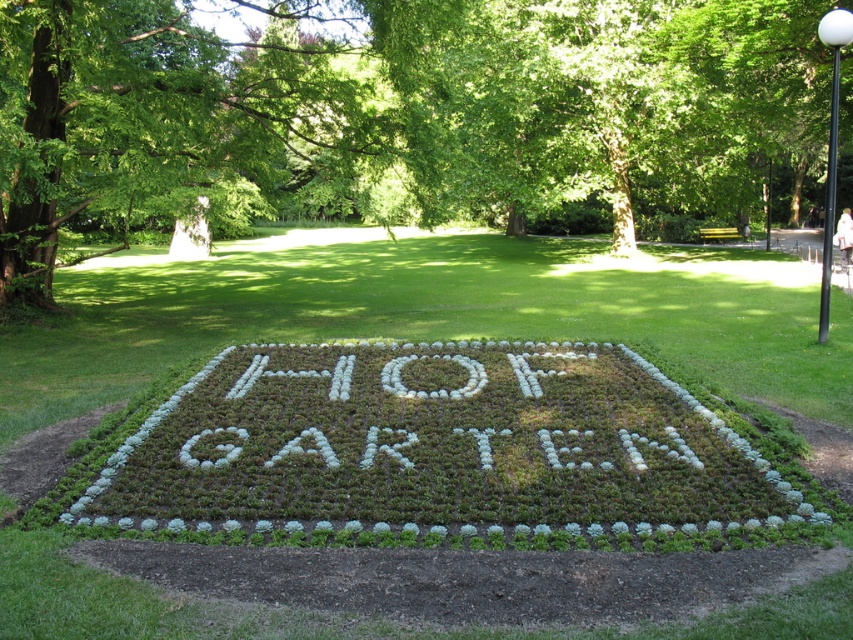
You are standing in the garden and want to take a photo of both the point at coordinates (224, 92) and the point at coordinates (828, 204). Which point should you focus on first to ensure both are in focus?

You should focus on the point at coordinates (224, 92) first because it is closer to the camera than the point at coordinates (828, 204). This ensures the foreground and background are both in focus.

You are a gardener planning to install a new sprinkler system. You need to place a water pipe that runs from the black metal pole at upper right to the green leafy tree at center. Based on the garden layout, will the pipe need to go upwards or downwards from the pole to reach the tree?

The green leafy tree at center is located above the black metal pole at upper right, so the pipe will need to go upwards from the pole to reach the tree.